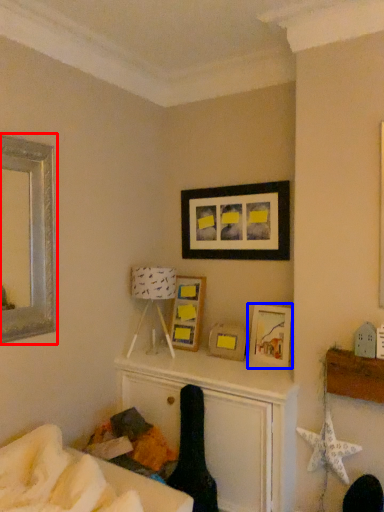
Question: Among these objects, which one is farthest to the camera, picture frame (highlighted by a red box) or picture frame (highlighted by a blue box)?

Choices:
 (A) picture frame
 (B) picture frame

Answer: (B)